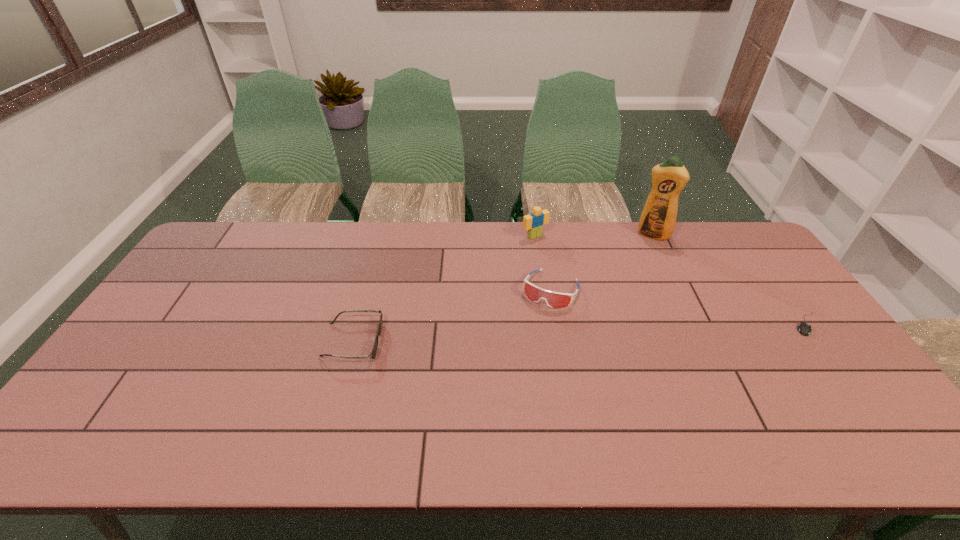
Locate an element on the screen. This screenshot has width=960, height=540. detergent located in the far edge section of the desktop is located at coordinates (658, 218).

Find the location of a particular element. This screenshot has width=960, height=540. Lego present at the far edge is located at coordinates (534, 222).

Identify the location of object that is at the right edge. The image size is (960, 540). (804, 328).

Where is `free region at the far edge of the desktop`? This screenshot has width=960, height=540. free region at the far edge of the desktop is located at coordinates (518, 252).

In the image, there is a desktop. Find the location of `vacant space at the near edge`. vacant space at the near edge is located at coordinates (449, 409).

Find the location of a particular element. The height and width of the screenshot is (540, 960). vacant space at the left edge is located at coordinates (193, 339).

Where is `blank space at the far left corner of the desktop`? The width and height of the screenshot is (960, 540). blank space at the far left corner of the desktop is located at coordinates (225, 252).

This screenshot has width=960, height=540. In order to click on vacant space at the far right corner of the desktop in this screenshot , I will do `click(727, 241)`.

Identify the location of vacant area between the goggles and the sunglasses. Image resolution: width=960 pixels, height=540 pixels. (452, 315).

Image resolution: width=960 pixels, height=540 pixels. Find the location of `vacant region between the detergent and the sunglasses`. vacant region between the detergent and the sunglasses is located at coordinates (503, 288).